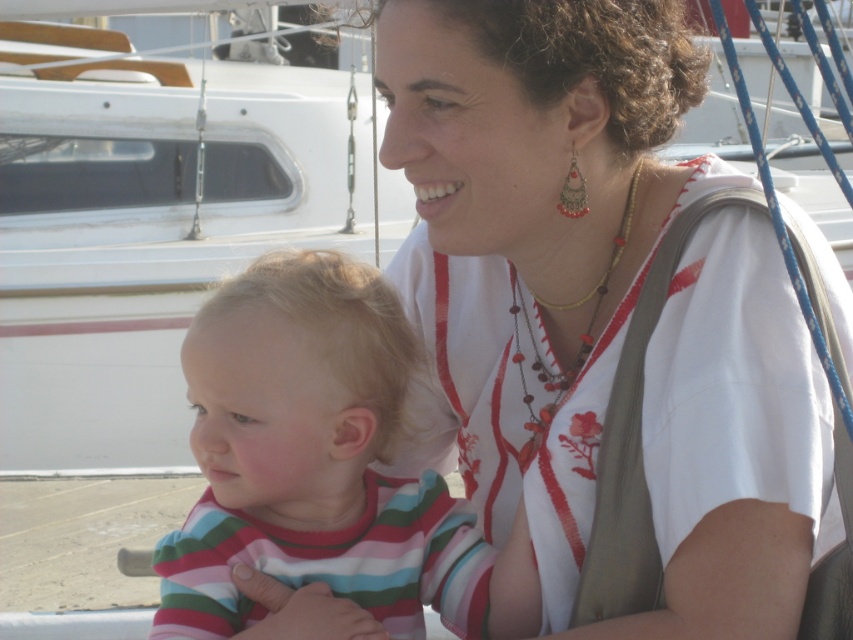
You are a photographer trying to capture a closeup of the striped cotton shirt at center and the multicolored beaded necklace at upper center. Given that your camera can focus on objects within a 12 inch range, will you need to adjust your position to ensure both are in focus?

The striped cotton shirt at center is 14.76 inches from the multicolored beaded necklace at upper center. Since the distance exceeds the camera focus range of 12 inches, you will need to adjust your position to ensure both are in focus.